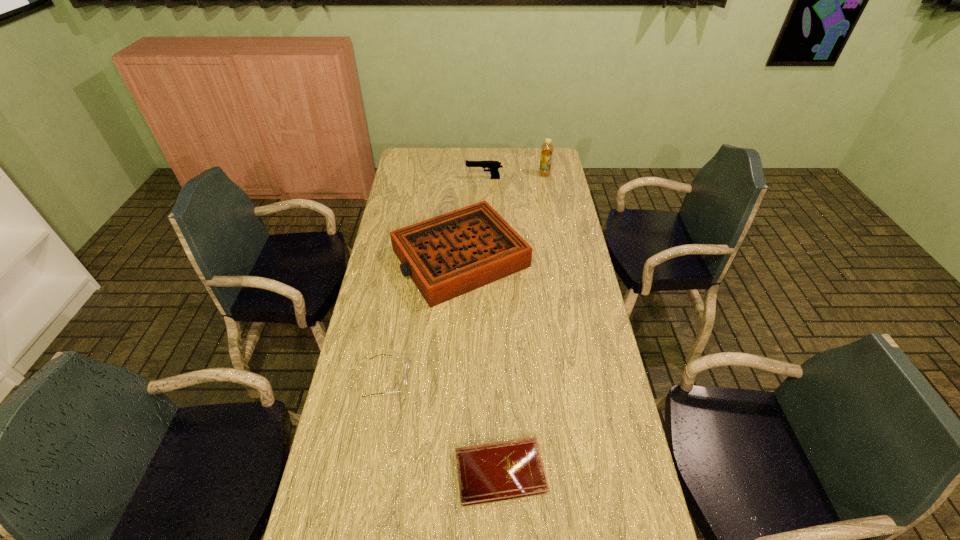
In the image, there is a desktop. Identify the location of blank space at the far edge. (488, 153).

You are a GUI agent. You are given a task and a screenshot of the screen. Output one action in this format:
    pyautogui.click(x=<x>, y=<y>)
    Task: Click on the vacant space at the left edge of the desktop
    The image size is (960, 540).
    Given the screenshot: What is the action you would take?
    pyautogui.click(x=336, y=419)

In the image, there is a desktop. At what (x,y) coordinates should I click in order to perform the action: click on vacant space at the right edge. Please return your answer as a coordinate pair (x, y). Looking at the image, I should click on (603, 340).

Where is `free space at the far right corner of the desktop`? free space at the far right corner of the desktop is located at coordinates (554, 153).

Where is `vacant area between the third farthest object and the nearest object`? This screenshot has width=960, height=540. vacant area between the third farthest object and the nearest object is located at coordinates (480, 365).

Find the location of a particular element. free space between the notebook and the gameboard is located at coordinates (480, 365).

The width and height of the screenshot is (960, 540). What are the coordinates of `empty space that is in between the second nearest object and the gameboard` in the screenshot? It's located at (423, 318).

Where is `vacant area between the shortest object and the fourth tallest object`? The height and width of the screenshot is (540, 960). vacant area between the shortest object and the fourth tallest object is located at coordinates (444, 425).

Where is `empty space between the bottle and the pistol`? Image resolution: width=960 pixels, height=540 pixels. empty space between the bottle and the pistol is located at coordinates (515, 177).

Find the location of `free point between the bottle and the third farthest object`. free point between the bottle and the third farthest object is located at coordinates (502, 217).